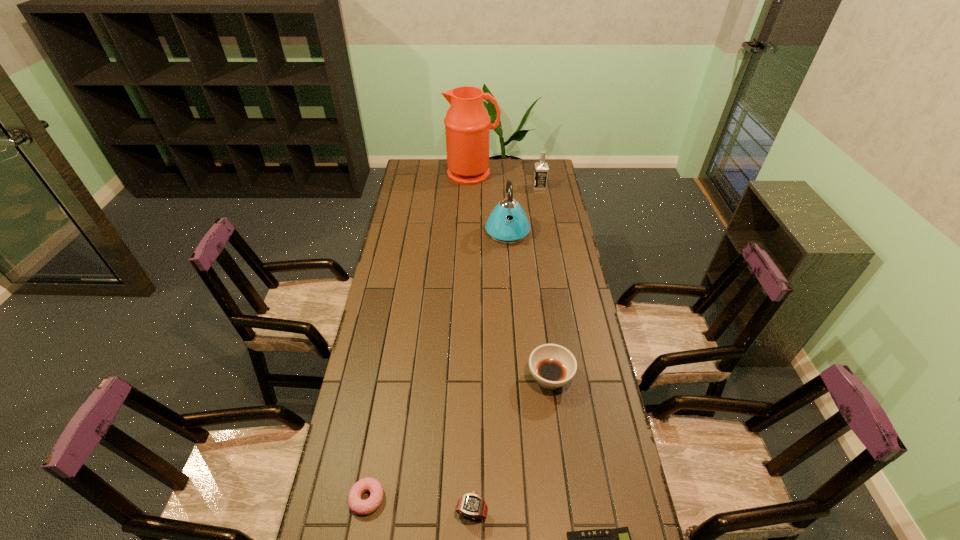
Locate an element on the screen. The width and height of the screenshot is (960, 540). water jug is located at coordinates (467, 124).

At what (x,y) coordinates should I click in order to perform the action: click on kettle. Please return your answer as a coordinate pair (x, y). This screenshot has height=540, width=960. Looking at the image, I should click on (508, 223).

Where is `the third farthest object`? the third farthest object is located at coordinates (508, 223).

Where is `the third tallest object`? This screenshot has height=540, width=960. the third tallest object is located at coordinates (541, 168).

This screenshot has height=540, width=960. I want to click on the fourth nearest object, so click(553, 366).

This screenshot has width=960, height=540. Identify the location of soup bowl. (553, 366).

Locate an element on the screen. This screenshot has height=540, width=960. the fifth tallest object is located at coordinates (471, 505).

I want to click on the leftmost object, so click(362, 507).

The width and height of the screenshot is (960, 540). I want to click on doughnut, so click(x=362, y=507).

Find the location of `free location located from the spout of the tallest object`. free location located from the spout of the tallest object is located at coordinates [471, 211].